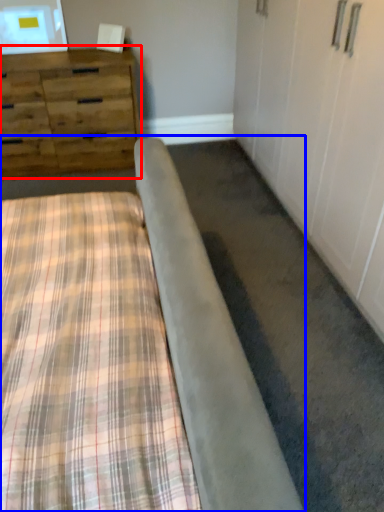
Question: Which object is closer to the camera taking this photo, chest of drawers (highlighted by a red box) or bed (highlighted by a blue box)?

Choices:
 (A) chest of drawers
 (B) bed

Answer: (B)